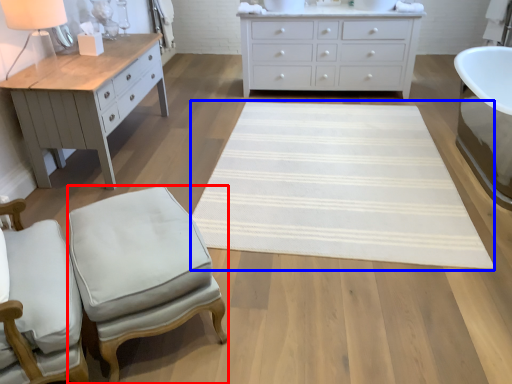
Question: Which point is further to the camera, stool (highlighted by a red box) or mat (highlighted by a blue box)?

Choices:
 (A) stool
 (B) mat

Answer: (B)